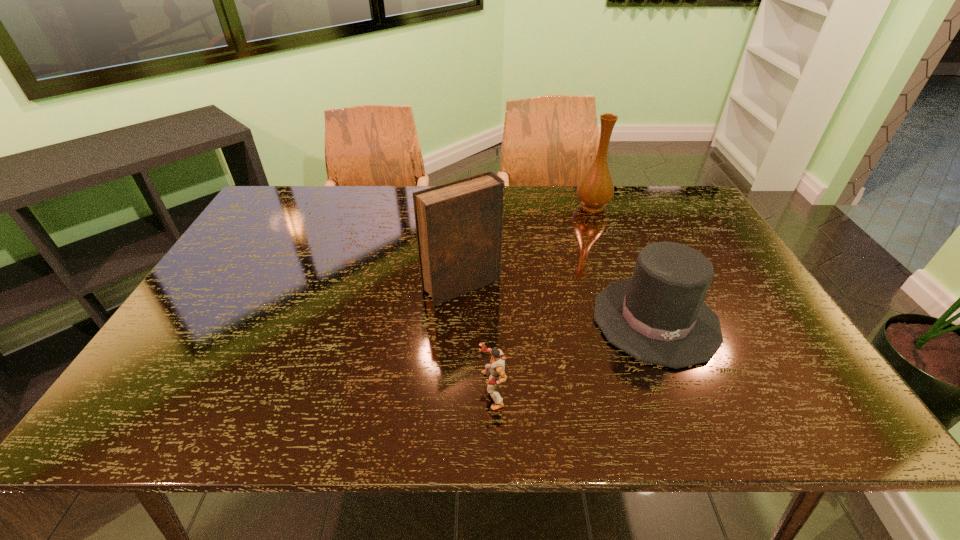
At what (x,y) coordinates should I click in order to perform the action: click on free area in between the farthest object and the nearest object. Please return your answer as a coordinate pair (x, y). This screenshot has width=960, height=540. Looking at the image, I should click on (542, 298).

The height and width of the screenshot is (540, 960). Find the location of `free spot between the farthest object and the second shortest object`. free spot between the farthest object and the second shortest object is located at coordinates (624, 263).

Locate an element on the screen. free space that is in between the shortest object and the second shortest object is located at coordinates tap(574, 355).

Locate an element on the screen. Image resolution: width=960 pixels, height=540 pixels. free space between the shortest object and the farthest object is located at coordinates (542, 298).

Where is `free spot between the shortest object and the vase`? The image size is (960, 540). free spot between the shortest object and the vase is located at coordinates (542, 298).

Image resolution: width=960 pixels, height=540 pixels. In order to click on empty space that is in between the Bible and the dress hat in this screenshot , I will do `click(559, 303)`.

At what (x,y) coordinates should I click in order to perform the action: click on free space between the second shortest object and the vase. Please return your answer as a coordinate pair (x, y). The height and width of the screenshot is (540, 960). Looking at the image, I should click on coord(624,263).

This screenshot has height=540, width=960. In order to click on empty space between the vase and the Bible in this screenshot , I will do `click(527, 246)`.

Where is `free space between the third tallest object and the shortest object`? The image size is (960, 540). free space between the third tallest object and the shortest object is located at coordinates (574, 355).

Locate which object ranks third in proximity to the shortest object. Please provide its 2D coordinates. Your answer should be formatted as a tuple, i.e. [(x, y)], where the tuple contains the x and y coordinates of a point satisfying the conditions above.

[(595, 190)]